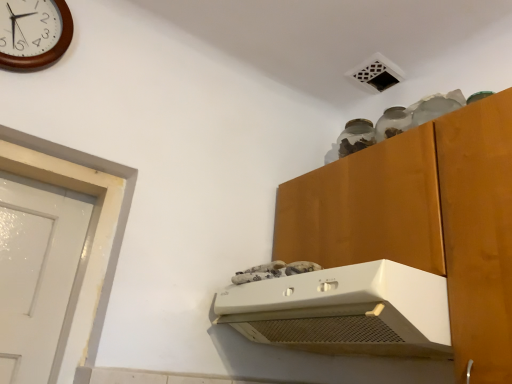
Question: From the image's perspective, is white plastic range hood at upper center positioned above or below wooden clock at upper left?

Choices:
 (A) below
 (B) above

Answer: (A)

Question: In terms of height, does white plastic range hood at upper center look taller or shorter compared to wooden clock at upper left?

Choices:
 (A) short
 (B) tall

Answer: (A)

Question: Is white plastic range hood at upper center wider or thinner than wooden clock at upper left?

Choices:
 (A) wide
 (B) thin

Answer: (A)

Question: Is wooden clock at upper left inside or outside of white plastic range hood at upper center?

Choices:
 (A) outside
 (B) inside

Answer: (A)

Question: From a real-world perspective, relative to white plastic range hood at upper center, is wooden clock at upper left vertically above or below?

Choices:
 (A) below
 (B) above

Answer: (B)

Question: Based on their sizes in the image, would you say wooden clock at upper left is bigger or smaller than white plastic range hood at upper center?

Choices:
 (A) small
 (B) big

Answer: (A)

Question: Would you say wooden clock at upper left is to the left or to the right of white plastic range hood at upper center in the picture?

Choices:
 (A) left
 (B) right

Answer: (A)